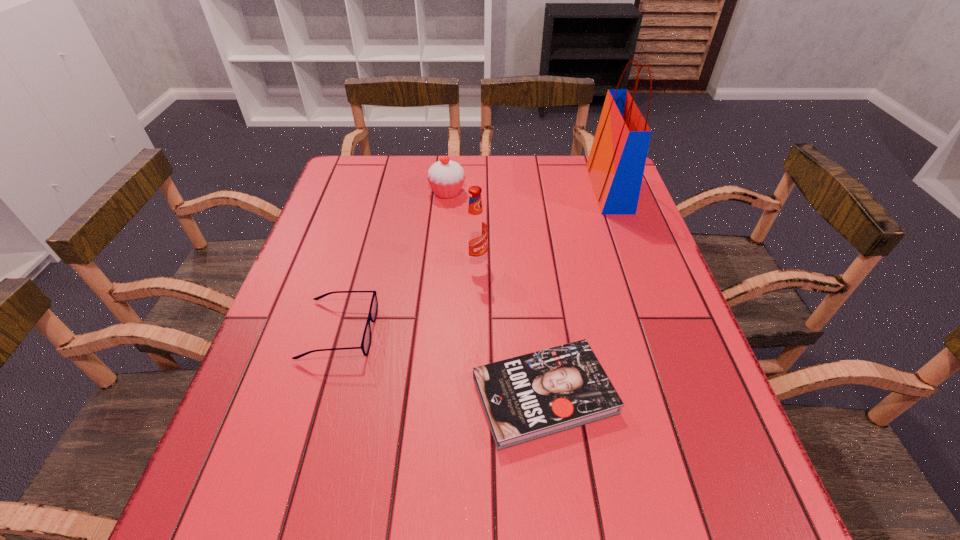
Identify the location of free point between the shortest object and the third nearest object. This screenshot has width=960, height=540. (510, 328).

Identify the location of vacant area that lies between the third nearest object and the tallest object. (542, 225).

Identify the location of the fourth closest object to the third tallest object. (531, 396).

Select which object appears as the fourth closest to the shopping bag. Please provide its 2D coordinates. Your answer should be formatted as a tuple, i.e. [(x, y)], where the tuple contains the x and y coordinates of a point satisfying the conditions above.

[(366, 339)]

Find the location of a particular element. blank space that satisfies the following two spatial constraints: 1. on the front side of the cupcake; 2. on the left side of the book is located at coordinates (429, 395).